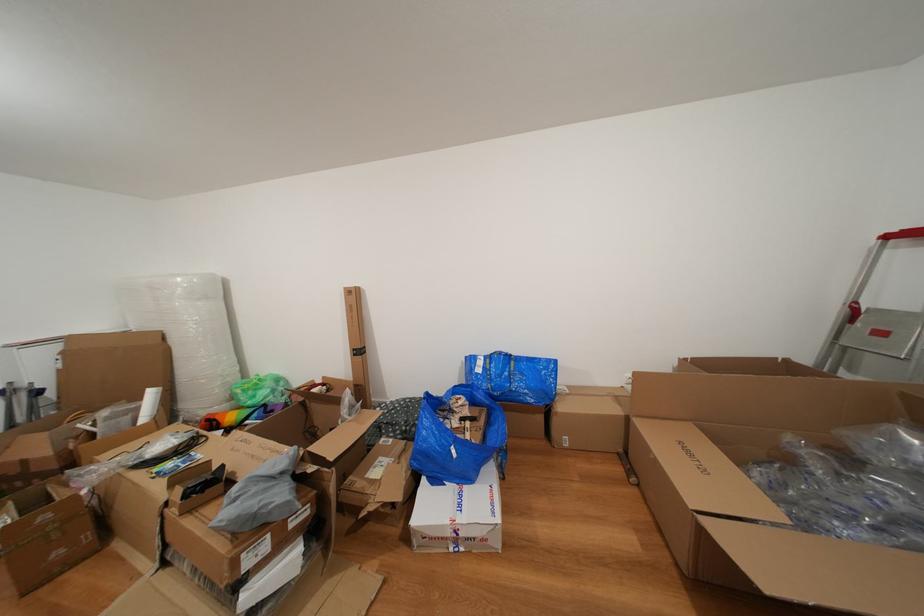
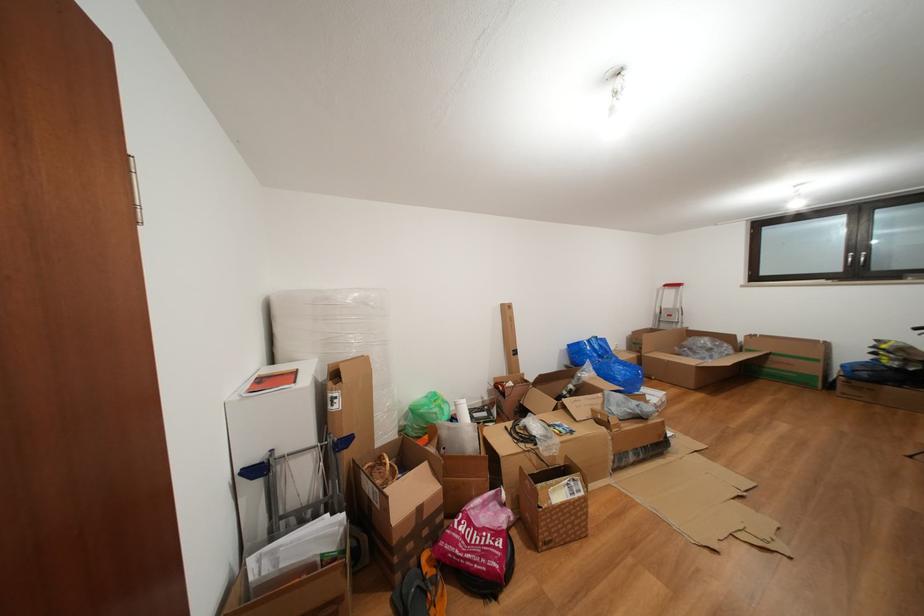
Find the pixel in the second image that matches point 896,241 in the first image.

(674, 291)